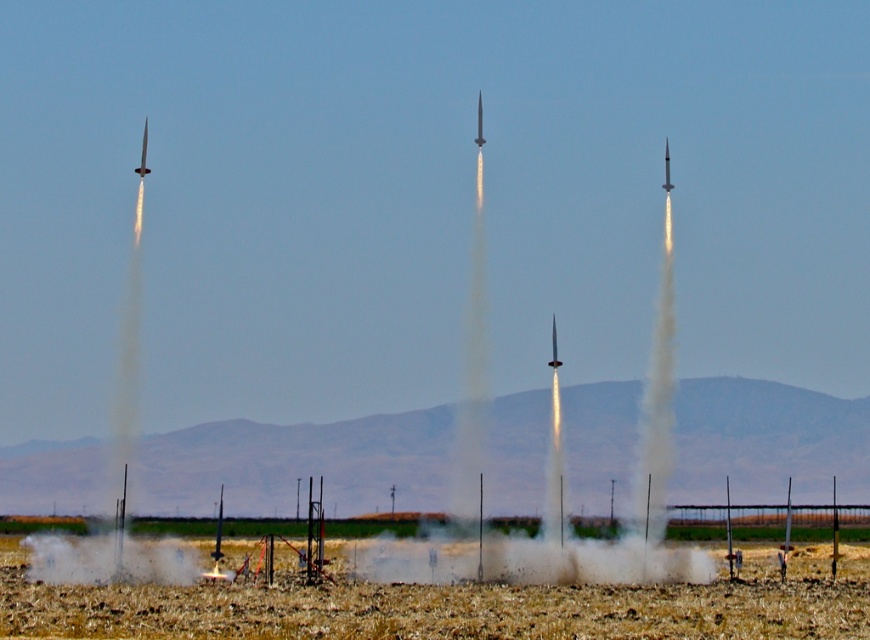
Question: Is white matte smoke at left above matte silver rocket at center?

Choices:
 (A) yes
 (B) no

Answer: (A)

Question: Observing the image, what is the correct spatial positioning of white vapor rocket at center in reference to matte silver rocket at center?

Choices:
 (A) above
 (B) below

Answer: (A)

Question: Is white vapor rocket at center positioned behind shiny silver rocket at center?

Choices:
 (A) yes
 (B) no

Answer: (B)

Question: Considering the real-world distances, which object is closest to the shiny silver rocket at center?

Choices:
 (A) white matte smoke at left
 (B) shiny metallic missile at center
 (C) shiny silver missile at upper left

Answer: (B)

Question: Which point is farther to the camera?

Choices:
 (A) white vapor rocket at center
 (B) white matte smoke at left
 (C) shiny metallic missile at center
 (D) matte silver rocket at center

Answer: (D)

Question: Which point is closer to the camera taking this photo?

Choices:
 (A) (666, 140)
 (B) (474, 268)
 (C) (145, 173)

Answer: (C)